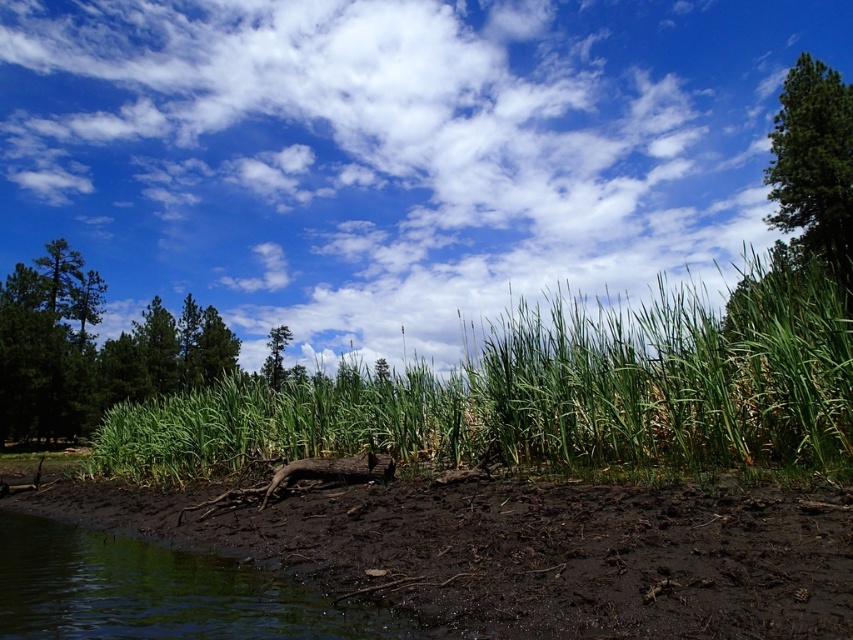
Question: Which point is farther to the camera?

Choices:
 (A) brown muddy ground at lower left
 (B) green matte tree at upper left
 (C) white fluffy cloud at upper center

Answer: (C)

Question: Can you confirm if white fluffy cloud at upper center is positioned above green matte tree at upper left?

Choices:
 (A) no
 (B) yes

Answer: (B)

Question: Among these points, which one is farthest from the camera?

Choices:
 (A) (541, 497)
 (B) (136, 362)
 (C) (798, 198)

Answer: (B)

Question: Can you confirm if green grass at center is positioned below green leafy tree at center?

Choices:
 (A) no
 (B) yes

Answer: (B)

Question: Is white fluffy cloud at upper center bigger than green grass at center?

Choices:
 (A) yes
 (B) no

Answer: (A)

Question: Among these points, which one is farthest from the camera?

Choices:
 (A) tap(70, 296)
 (B) tap(225, 371)
 (C) tap(824, 305)

Answer: (B)